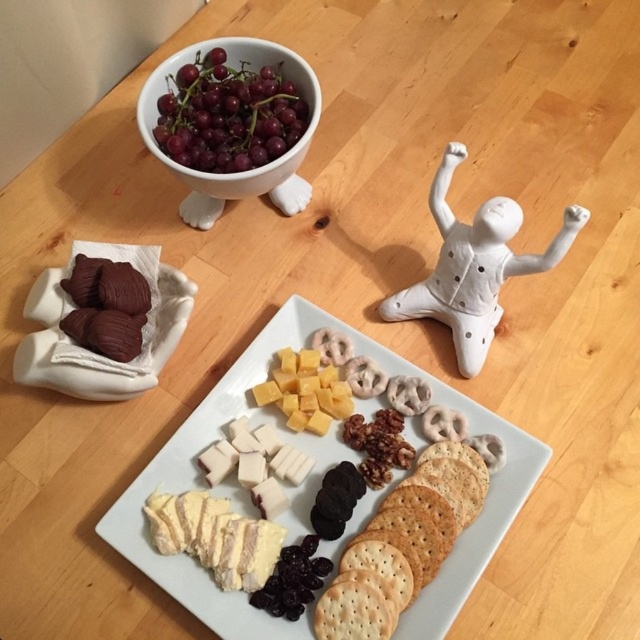
Question: Can you confirm if matte chocolate truffles at upper left is smaller than dark purple grapes at lower center?

Choices:
 (A) yes
 (B) no

Answer: (B)

Question: Among these points, which one is nearest to the camera?

Choices:
 (A) (272, 112)
 (B) (342, 385)
 (C) (273, 595)
 (D) (499, 200)

Answer: (C)

Question: Is white matte figurine at upper right smaller than purple grapes at upper left?

Choices:
 (A) no
 (B) yes

Answer: (A)

Question: Observing the image, what is the correct spatial positioning of sliced cheese at center in reference to dark purple grapes at lower center?

Choices:
 (A) left
 (B) right

Answer: (B)

Question: Which point is closer to the camera?

Choices:
 (A) matte chocolate truffles at upper left
 (B) purple grapes at upper left

Answer: (A)

Question: Estimate the real-world distances between objects in this image. Which object is farther from the matte chocolate truffles at upper left?

Choices:
 (A) white matte figurine at upper right
 (B) sliced cheese at center
 (C) dark purple grapes at lower center

Answer: (A)